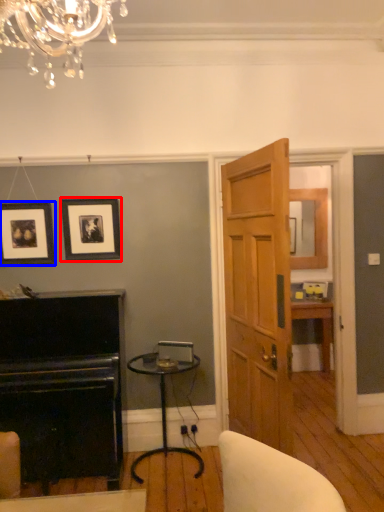
Question: Which of the following is the closest to the observer, picture frame (highlighted by a red box) or picture frame (highlighted by a blue box)?

Choices:
 (A) picture frame
 (B) picture frame

Answer: (B)